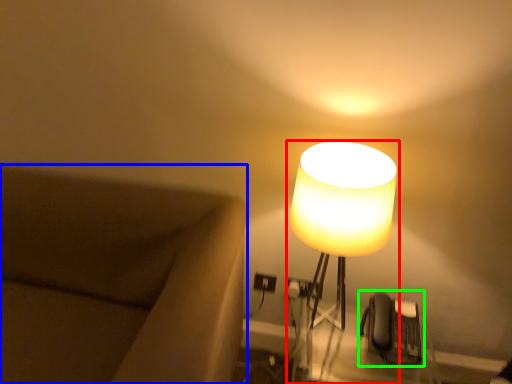
Question: Considering the real-world distances, which object is closest to lamp (highlighted by a red box)? furniture (highlighted by a blue box) or swivel chair (highlighted by a green box).

Choices:
 (A) furniture
 (B) swivel chair

Answer: (B)